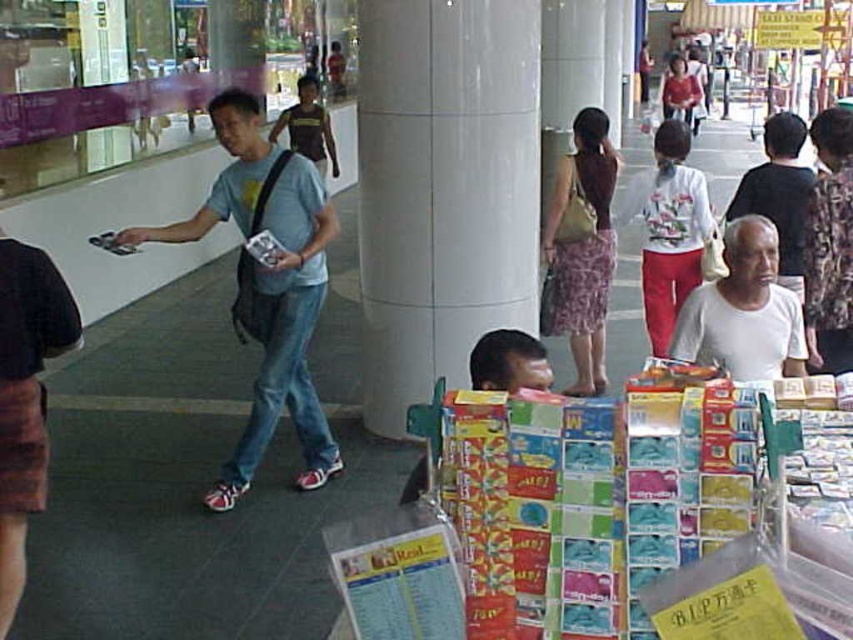
I want to click on white floral shirt at center, so click(671, 230).

In the scene shown: Is white floral shirt at center positioned before matte red shirt at center?

Yes, white floral shirt at center is closer to the viewer.

You are a GUI agent. You are given a task and a screenshot of the screen. Output one action in this format:
    pyautogui.click(x=<x>, y=<y>)
    Task: Click on the white floral shirt at center
    
    Given the screenshot: What is the action you would take?
    pyautogui.click(x=671, y=230)

Between point (537, 61) and point (546, 257), which one is positioned behind?

The point (546, 257) is more distant.

Is point (410, 307) closer to camera compared to point (592, 116)?

Yes, it is.

In order to click on white glossy pillar at center in this screenshot , I will do `click(444, 188)`.

Is white matte shirt at center positioned behind brown textured shirt at center?

No.

How distant is white matte shirt at center from brown textured shirt at center?

white matte shirt at center and brown textured shirt at center are 22.64 feet apart.

Which is behind, point (755, 323) or point (302, 93)?

Point (302, 93)

You are a GUI agent. You are given a task and a screenshot of the screen. Output one action in this format:
    pyautogui.click(x=<x>, y=<y>)
    Task: Click on the white matte shirt at center
    
    Given the screenshot: What is the action you would take?
    pyautogui.click(x=744, y=310)